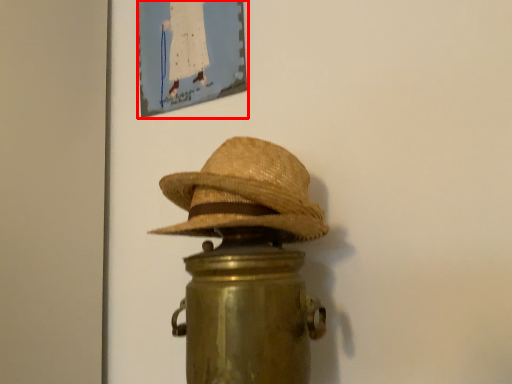
Question: Observing the image, what is the correct spatial positioning of picture frame (annotated by the red box) in reference to cowboy hat?

Choices:
 (A) right
 (B) left

Answer: (B)